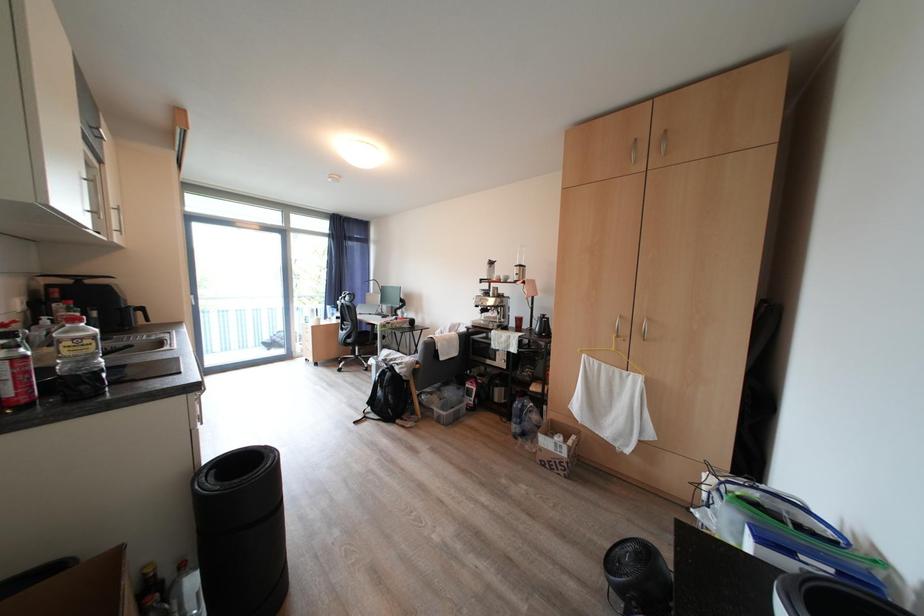
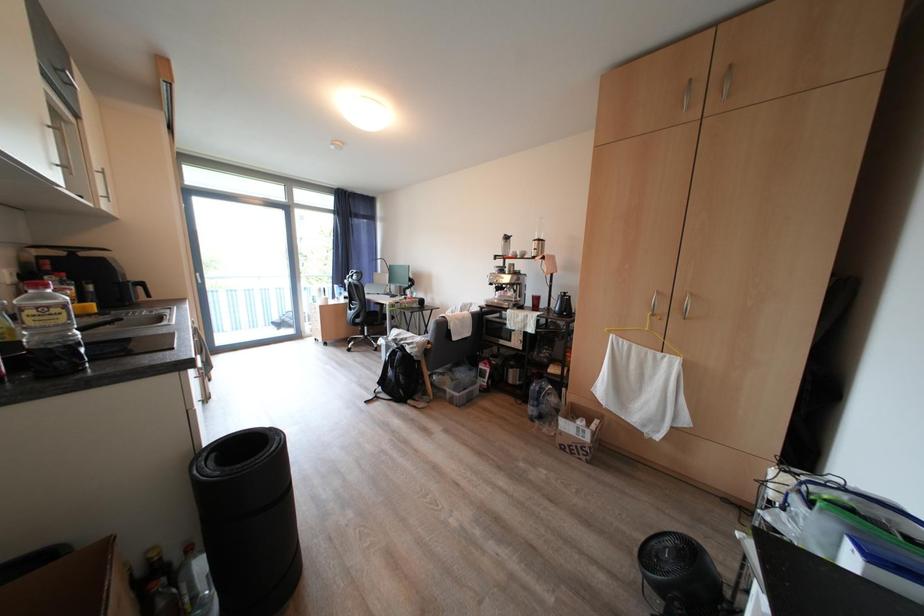
What movement of the cameraman would produce the second image?

The movement direction of the cameraman is left, forward.